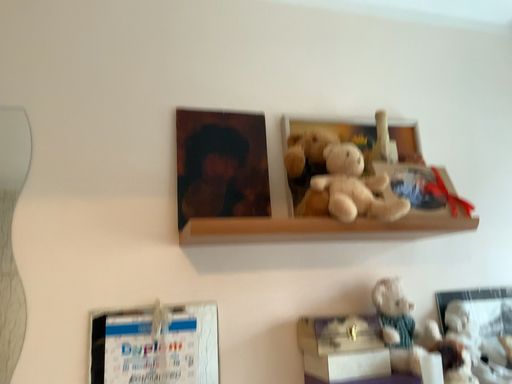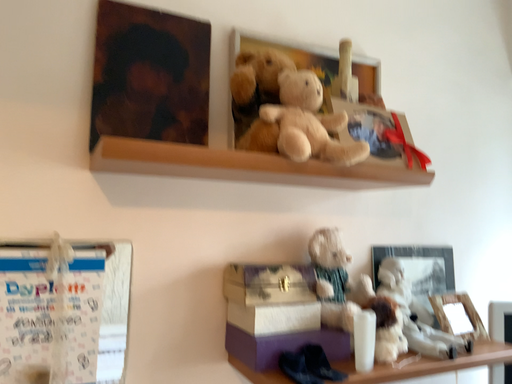
Question: Which way did the camera rotate in the video?

Choices:
 (A) rotated right
 (B) rotated left

Answer: (A)